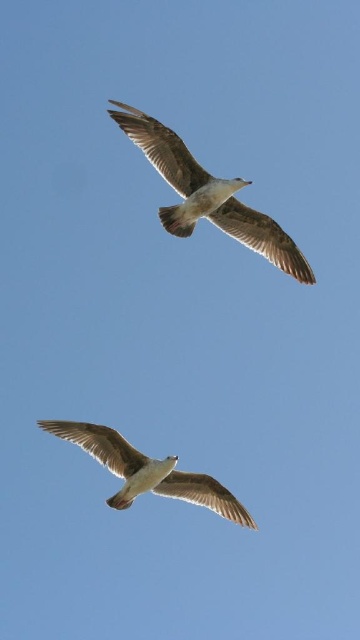
Who is positioned more to the right, white feathered bird at upper center or white feathered bird at center?

Positioned to the right is white feathered bird at upper center.

Is white feathered bird at upper center bigger than white feathered bird at center?

No.

Is point (209, 186) behind point (210, 500)?

No, it is not.

Find the location of a particular element. The image size is (360, 640). white feathered bird at upper center is located at coordinates (208, 195).